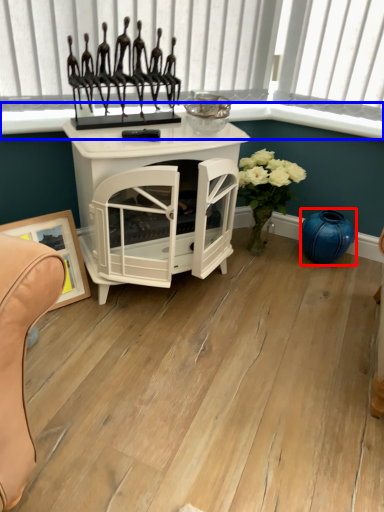
Question: Which object is further to the camera taking this photo, vase (highlighted by a red box) or window sill (highlighted by a blue box)?

Choices:
 (A) vase
 (B) window sill

Answer: (A)